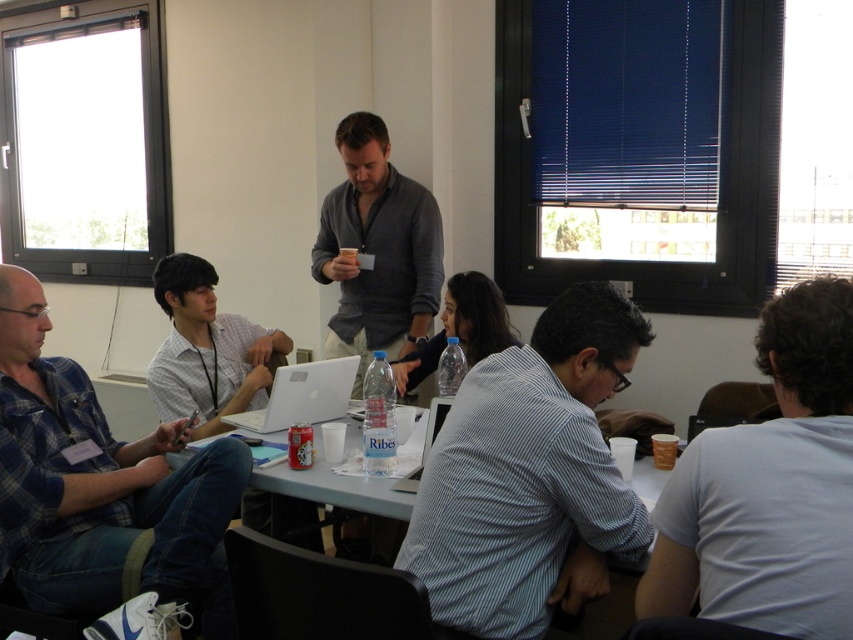
Question: Which point appears farthest from the camera in this image?

Choices:
 (A) (379, 284)
 (B) (625, 563)

Answer: (A)

Question: Based on their relative distances, which object is farther from the gray cotton shirt at center?

Choices:
 (A) blue plaid shirt at lower left
 (B) white cotton shirt at lower right

Answer: (B)

Question: Can you confirm if white plastic table at center is positioned to the left of white glossy laptop at center?

Choices:
 (A) yes
 (B) no

Answer: (B)

Question: Which of these objects is positioned farthest from the white glossy shirt at center?

Choices:
 (A) white plastic table at center
 (B) white cotton shirt at lower right
 (C) white plastic laptop at center

Answer: (B)

Question: Can you confirm if white cotton shirt at lower right is positioned below white plastic laptop at center?

Choices:
 (A) no
 (B) yes

Answer: (A)

Question: Can you confirm if white cotton shirt at lower right is smaller than white glossy laptop at center?

Choices:
 (A) yes
 (B) no

Answer: (B)